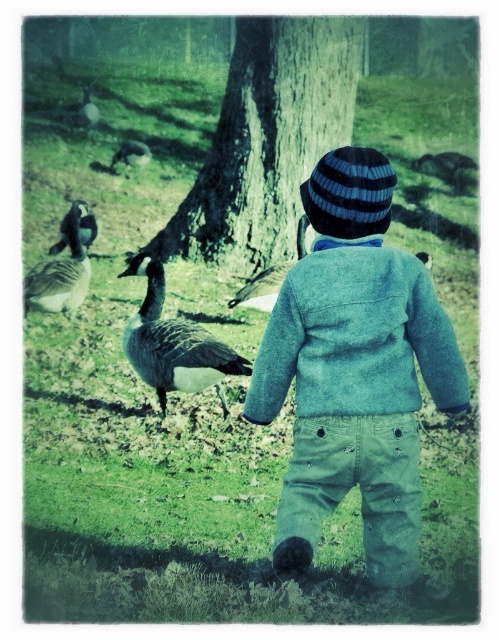
Question: Considering the real-world distances, which object is farthest from the gray feathered goose at upper left?

Choices:
 (A) dark gray feathers at left
 (B) gray-feathered duck at center
 (C) gray feathered duck at center
 (D) brown feathered bird at upper right

Answer: (B)

Question: Which point appears farthest from the camera in this image?

Choices:
 (A) (286, 56)
 (B) (243, 288)

Answer: (A)

Question: Is gray feathered goose at left bigger than brown feathered bird at upper right?

Choices:
 (A) yes
 (B) no

Answer: (B)

Question: Which point is farther to the camera?

Choices:
 (A) (277, 266)
 (B) (148, 348)
 (C) (59, 227)
 (D) (183, 236)

Answer: (D)

Question: Is smooth bark tree at center above gray feathered duck at upper left?

Choices:
 (A) no
 (B) yes

Answer: (A)

Question: Is smooth bark tree at center below gray-feathered duck at center?

Choices:
 (A) yes
 (B) no

Answer: (B)